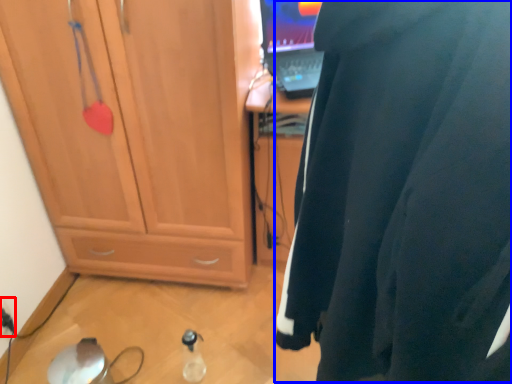
Question: Which object is closer to the camera taking this photo, electric outlet (highlighted by a red box) or wetsuit (highlighted by a blue box)?

Choices:
 (A) electric outlet
 (B) wetsuit

Answer: (B)